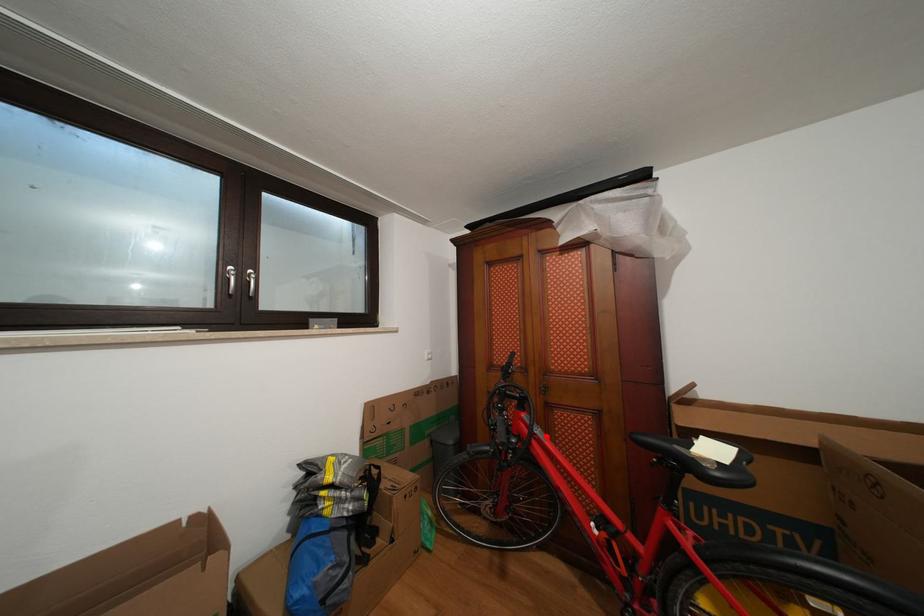
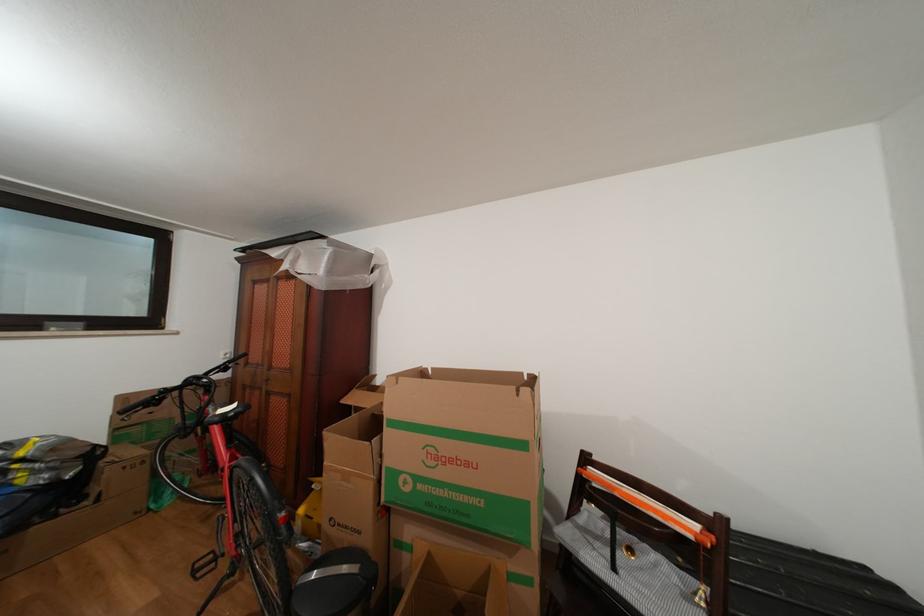
Find the pixel in the second image that matches the highlighted location in the first image.

(219, 414)